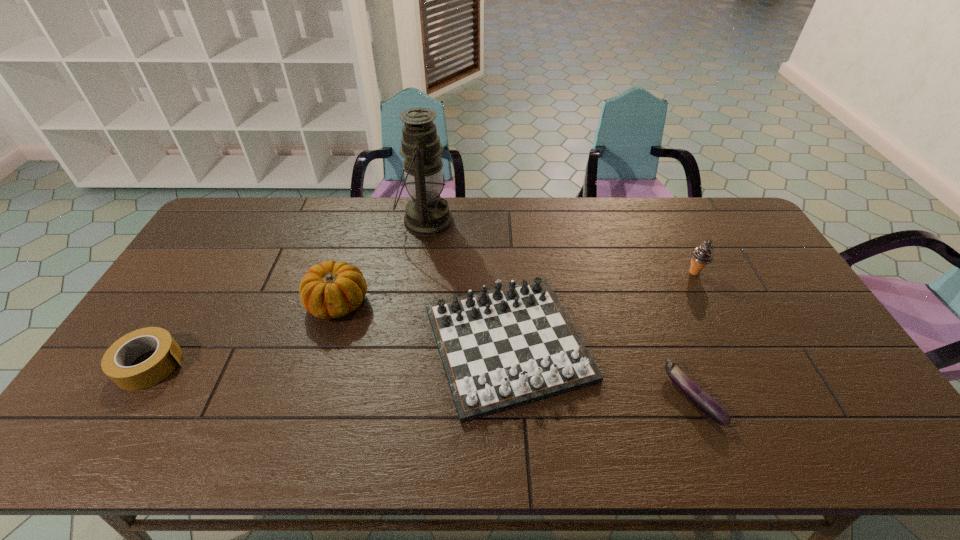
This screenshot has height=540, width=960. In order to click on the farthest object in this screenshot , I will do `click(427, 214)`.

You are a GUI agent. You are given a task and a screenshot of the screen. Output one action in this format:
    pyautogui.click(x=<x>, y=<y>)
    Task: Click on the oil lamp
    This screenshot has height=540, width=960.
    Given the screenshot: What is the action you would take?
    pyautogui.click(x=427, y=214)

Image resolution: width=960 pixels, height=540 pixels. Find the location of `icecream`. icecream is located at coordinates (702, 255).

Image resolution: width=960 pixels, height=540 pixels. I want to click on the second farthest object, so click(702, 255).

You are a GUI agent. You are given a task and a screenshot of the screen. Output one action in this format:
    pyautogui.click(x=<x>, y=<y>)
    Task: Click on the gourd
    
    Given the screenshot: What is the action you would take?
    pyautogui.click(x=331, y=289)

The height and width of the screenshot is (540, 960). In order to click on the third tallest object in this screenshot , I will do `click(331, 289)`.

What are the coordinates of `chessboard` in the screenshot? It's located at coord(502,348).

Find the location of a particular element. This screenshot has height=540, width=960. the second shortest object is located at coordinates tap(116, 363).

Where is `the leftmost object`? The image size is (960, 540). the leftmost object is located at coordinates (116, 363).

The image size is (960, 540). I want to click on the second object from right to left, so click(706, 403).